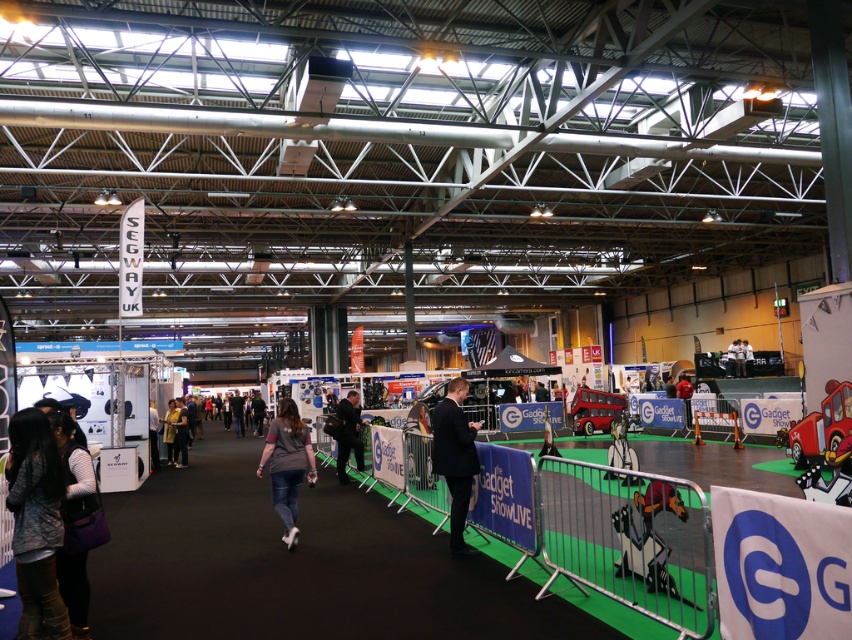
You are an event organizer at the trade show and need to arrange two items in a small booth. You have the dark blue suit at center and the matte gray jacket at center. Which item takes up less space and would be better suited for the limited area?

The dark blue suit at center occupies less space than the matte gray jacket at center, so it would be better suited for the limited area in the small booth.

You are standing in the exhibition hall and see the dark gray sweater at lower left. What are its exact coordinates in the image?

The dark gray sweater at lower left is located at coordinates (36,524).

You are attending a trade show and need to store your belongings. You see a purple fabric bag at lower left and a light brown leather jacket at center. Which item can hold more items vertically?

The purple fabric bag at lower left has a greater height compared to the light brown leather jacket at center, so it can hold more items vertically.